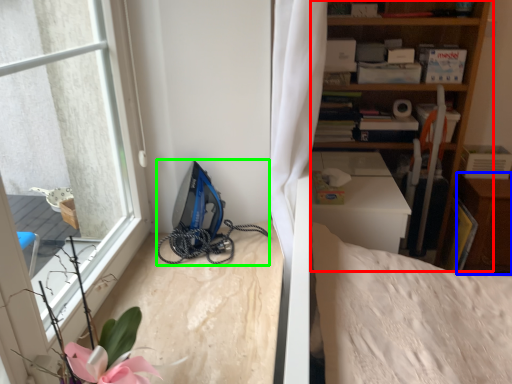
Question: Based on their relative distances, which object is farther from shelf (highlighted by a red box)? Choose from dresser (highlighted by a blue box) and equipment (highlighted by a green box).

Choices:
 (A) dresser
 (B) equipment

Answer: (B)